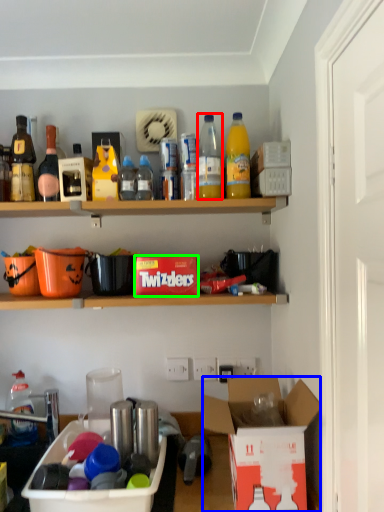
Question: Estimate the real-world distances between objects in this image. Which object is farther from bottle (highlighted by a red box), box (highlighted by a blue box) or box (highlighted by a green box)?

Choices:
 (A) box
 (B) box

Answer: (A)